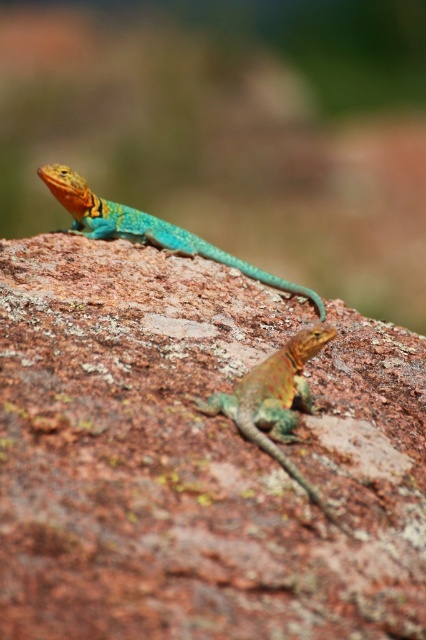
Question: Considering the real-world distances, which object is closest to the shiny turquoise lizard at upper center?

Choices:
 (A) shiny green lizard at center
 (B) rusty rock at center

Answer: (B)

Question: Which of the following is the farthest from the observer?

Choices:
 (A) (146, 221)
 (B) (238, 387)

Answer: (A)

Question: Where is rusty rock at center located in relation to shiny turquoise lizard at upper center in the image?

Choices:
 (A) below
 (B) above

Answer: (A)

Question: Where is rusty rock at center located in relation to shiny green lizard at center in the image?

Choices:
 (A) below
 (B) above

Answer: (B)

Question: Which of these objects is positioned closest to the shiny turquoise lizard at upper center?

Choices:
 (A) shiny green lizard at center
 (B) rusty rock at center

Answer: (B)

Question: Can you confirm if rusty rock at center is positioned below shiny green lizard at center?

Choices:
 (A) yes
 (B) no

Answer: (B)